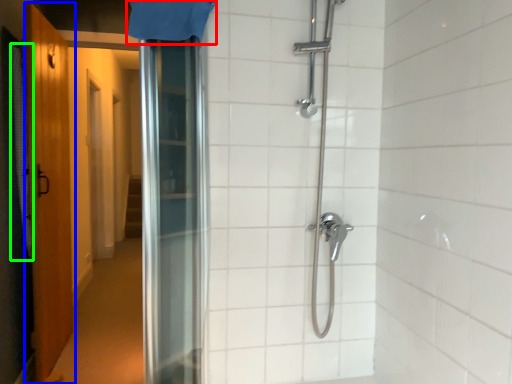
Question: Estimate the real-world distances between objects in this image. Which object is closer to shower curtain (highlighted by a red box), door (highlighted by a blue box) or shower curtain (highlighted by a green box)?

Choices:
 (A) door
 (B) shower curtain

Answer: (B)